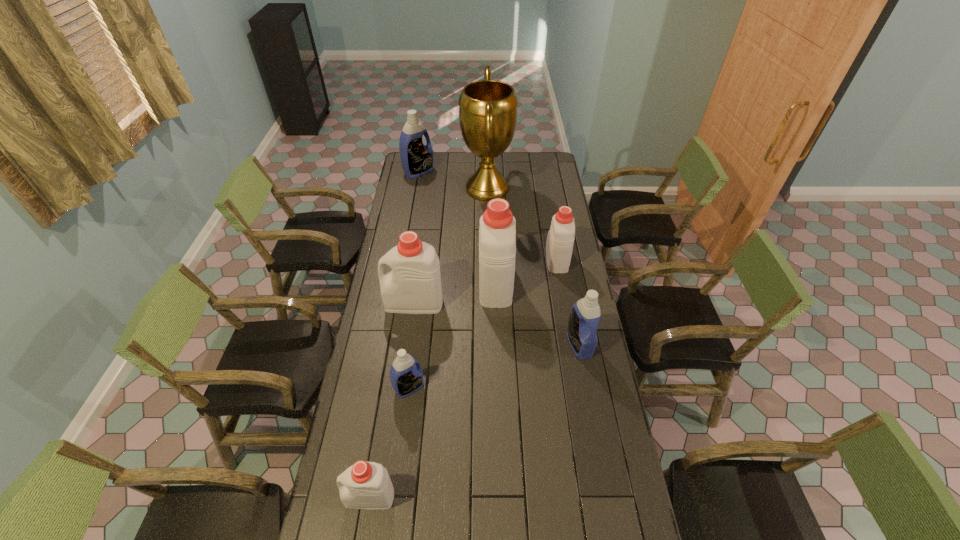
Where is `vacant space located on the front of the farthest blue detergent`? The height and width of the screenshot is (540, 960). vacant space located on the front of the farthest blue detergent is located at coordinates (412, 211).

Where is `free region located 0.130m on the handle side of the third biggest white detergent`? This screenshot has width=960, height=540. free region located 0.130m on the handle side of the third biggest white detergent is located at coordinates (551, 227).

I want to click on vacant space located 0.280m on the handle side of the third biggest white detergent, so click(x=548, y=210).

Where is `vacant space situated 0.180m on the handle side of the third biggest white detergent`? This screenshot has width=960, height=540. vacant space situated 0.180m on the handle side of the third biggest white detergent is located at coordinates (550, 221).

This screenshot has height=540, width=960. Find the location of `free spot located 0.200m on the front of the sixth farthest object`. free spot located 0.200m on the front of the sixth farthest object is located at coordinates (592, 409).

Locate an element on the screen. The image size is (960, 540). free space located 0.340m on the back of the smallest blue detergent is located at coordinates (420, 307).

Locate an element on the screen. The image size is (960, 540). free space located on the handle side of the smallest white detergent is located at coordinates (329, 497).

Identify the location of trophy cup that is positioned at the far edge. The image size is (960, 540). (487, 108).

Find the location of `detergent that is at the far edge`. detergent that is at the far edge is located at coordinates (417, 159).

This screenshot has width=960, height=540. In order to click on object located at the far left corner in this screenshot , I will do `click(417, 159)`.